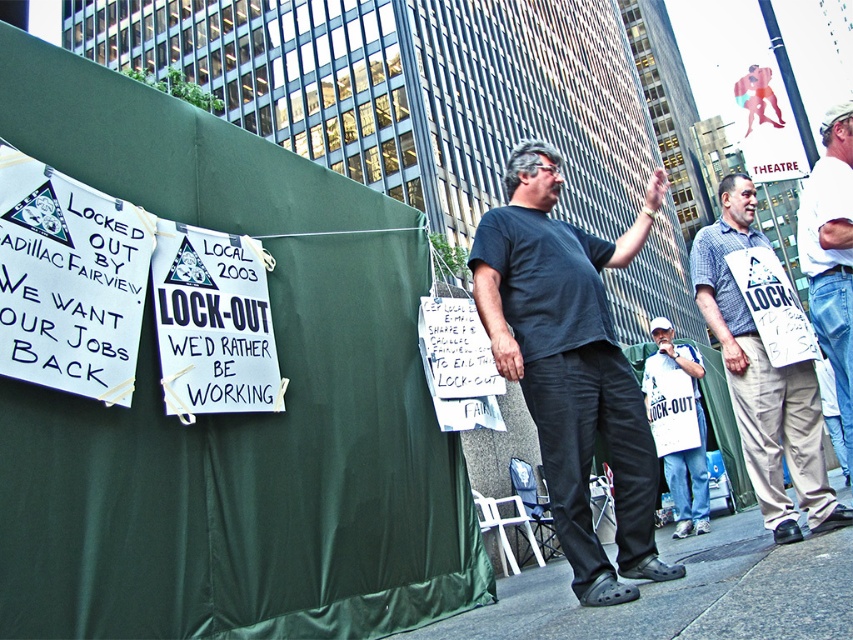
You are standing in front of the protest scene. There are two points marked in the image. The first point is at coordinate (523,144) and the second at (807,497). Which point is nearer to you?

Point (523,144) is closer to the viewer than point (807,497).

What is located at the coordinates point [831,253] in the image?

The point [831,253] corresponds to white denim jeans at right.